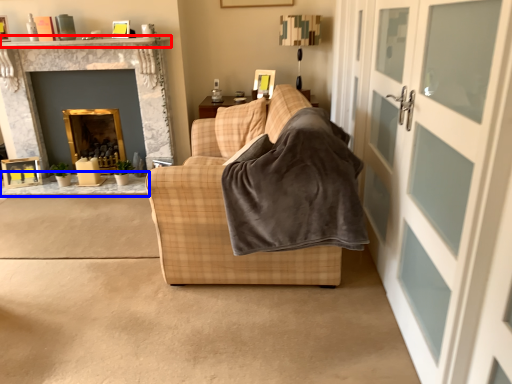
Question: Among these objects, which one is farthest to the camera, mantle (highlighted by a red box) or table (highlighted by a blue box)?

Choices:
 (A) mantle
 (B) table

Answer: (B)